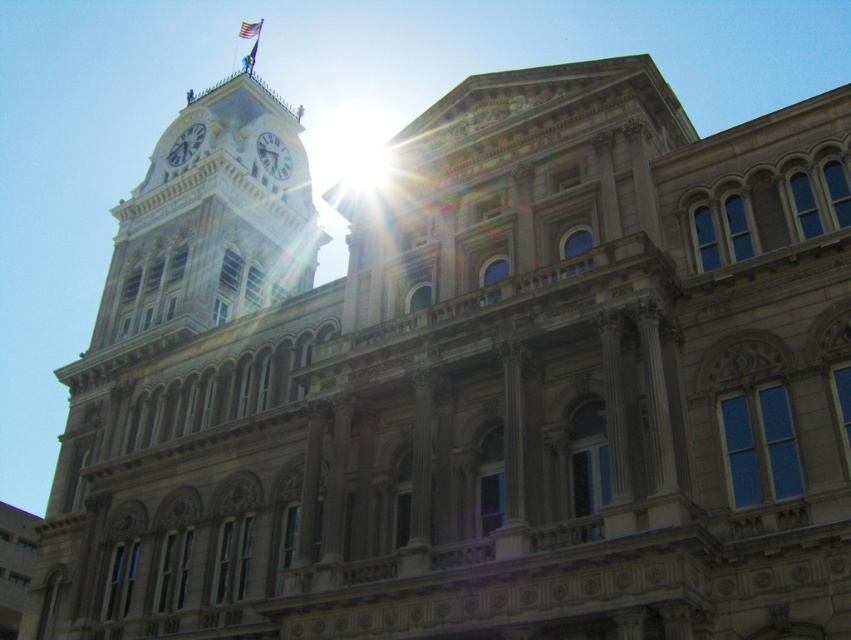
Is point (176, 163) positioned in front of point (243, 26)?

Yes, it is in front of point (243, 26).

What do you see at coordinates (186, 145) in the screenshot? This screenshot has width=851, height=640. I see `white glossy clock at upper left` at bounding box center [186, 145].

The image size is (851, 640). What are the coordinates of `white glossy clock at upper left` in the screenshot? It's located at (186, 145).

Where is `white glossy clock at upper left`? The height and width of the screenshot is (640, 851). white glossy clock at upper left is located at coordinates (186, 145).

Between white marble clock at upper center and white glossy clock at upper left, which one appears on the left side from the viewer's perspective?

white glossy clock at upper left is more to the left.

Can you confirm if white marble clock at upper center is smaller than white glossy clock at upper left?

Indeed, white marble clock at upper center has a smaller size compared to white glossy clock at upper left.

Locate an element on the screen. The height and width of the screenshot is (640, 851). white marble clock at upper center is located at coordinates (273, 156).

You are a GUI agent. You are given a task and a screenshot of the screen. Output one action in this format:
    pyautogui.click(x=<x>, y=<y>)
    Task: Click on the white marble clock at upper center
    Image resolution: width=851 pixels, height=640 pixels.
    Given the screenshot: What is the action you would take?
    pyautogui.click(x=273, y=156)

Does white marble clock at upper center appear on the right side of american flag at upper center?

Yes, white marble clock at upper center is to the right of american flag at upper center.

Is point (278, 177) positioned behind point (246, 24)?

No.

Where is `white marble clock at upper center`? Image resolution: width=851 pixels, height=640 pixels. white marble clock at upper center is located at coordinates (273, 156).